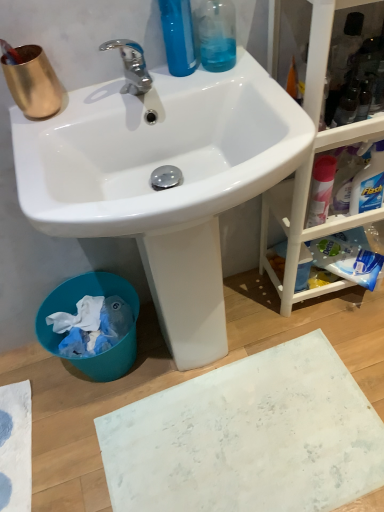
Question: From the image's perspective, is gold metallic cup at upper left above or below white matte bath mat at lower center?

Choices:
 (A) above
 (B) below

Answer: (A)

Question: In terms of height, does gold metallic cup at upper left look taller or shorter compared to white matte bath mat at lower center?

Choices:
 (A) tall
 (B) short

Answer: (A)

Question: Which object is the farthest from the white glossy sink at upper center?

Choices:
 (A) blue plastic trash bin at lower left
 (B) white matte bath mat at lower center
 (C) gold metallic cup at upper left
 (D) pink matte spray can at right
 (E) white wood cabinet at right

Answer: (B)

Question: Estimate the real-world distances between objects in this image. Which object is farther from the pink matte spray can at right?

Choices:
 (A) blue plastic trash bin at lower left
 (B) white wood cabinet at right
 (C) white matte bath mat at lower center
 (D) chrome metallic faucet at upper center
 (E) gold metallic cup at upper left

Answer: (A)